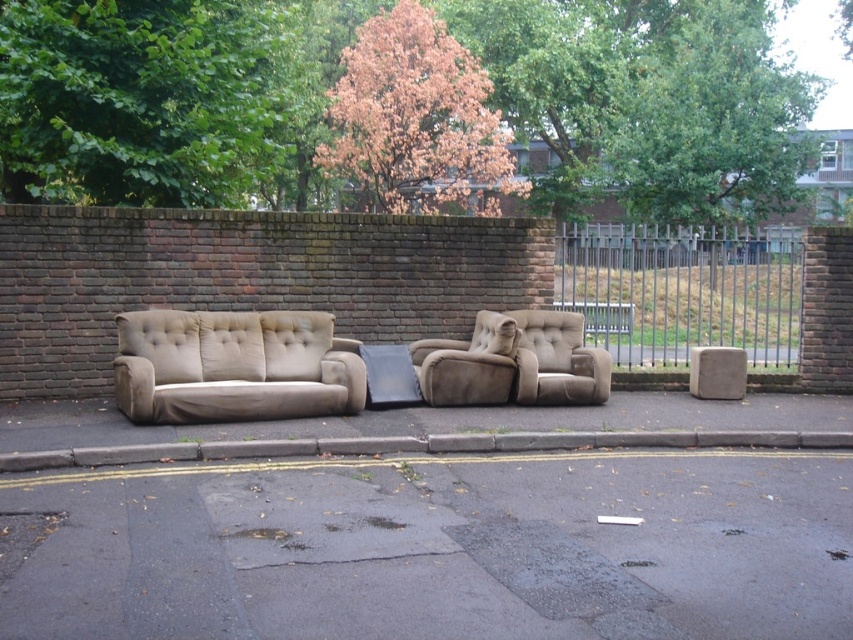
You are a delivery person trying to place a large package on the curb. The package is as big as the beige fabric armchair at center. Can you fit it on the gray concrete curb at lower center without moving the armchair?

The gray concrete curb at lower center has a larger size compared to beige fabric armchair at center, so yes, the package can fit on the gray concrete curb at lower center since it is bigger than the armchair.

You are a delivery person trying to place a new sofa that is 30 feet long between the beige fabric daybed at center and the metallic silver fence at right. Can you fit the sofa in that space?

The distance between the beige fabric daybed at center and the metallic silver fence at right is 28.82 feet, which is shorter than the 30 feet required for the sofa. Therefore, the sofa cannot be placed in that space.

You are a delivery person trying to place a new sofa that is 2 meters long. You see the beige fabric daybed at center and the metallic silver fence at right. Can the new sofa fit between them without touching either?

The beige fabric daybed at center is shorter than the metallic silver fence at right, so the distance between them may be sufficient. However, since the exact distance isn not provided, we cannot confirm if the 2 meter sofa will fit without more information.